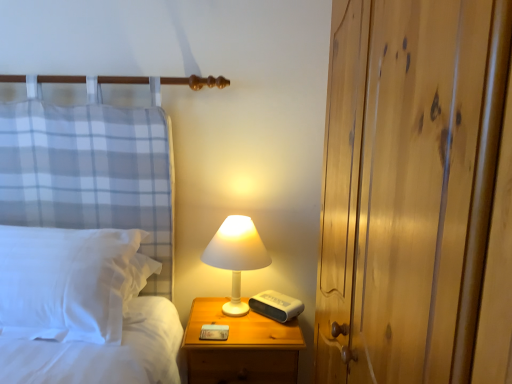
What are the coordinates of `empty space that is ontop of wooden nightstand at lower right (from a real-world perspective)` in the screenshot? It's located at (259, 304).